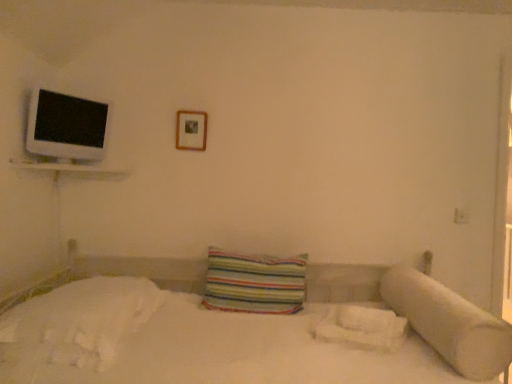
Question: Should I look upward or downward to see white soft pillow at right, arranged as the 1th pillow when viewed from the right?

Choices:
 (A) up
 (B) down

Answer: (B)

Question: Considering the relative positions of white glossy flat at upper left and white fluffy sheet at lower right, the second sheet from the left, in the image provided, is white glossy flat at upper left in front of white fluffy sheet at lower right, the second sheet from the left,?

Choices:
 (A) yes
 (B) no

Answer: (B)

Question: Does white glossy flat at upper left have a lesser height compared to white fluffy sheet at lower right, the second sheet from the left?

Choices:
 (A) no
 (B) yes

Answer: (A)

Question: Is white glossy flat at upper left behind white fluffy sheet at lower right, the second sheet from the left?

Choices:
 (A) yes
 (B) no

Answer: (A)

Question: From the image's perspective, would you say white glossy flat at upper left is shown under white fluffy sheet at lower right, arranged as the first sheet when viewed from the right?

Choices:
 (A) no
 (B) yes

Answer: (A)

Question: Is white glossy flat at upper left to the left of white fluffy sheet at lower right, the second sheet from the left, from the viewer's perspective?

Choices:
 (A) yes
 (B) no

Answer: (A)

Question: Is white glossy flat at upper left facing away from white fluffy sheet at lower right, arranged as the first sheet when viewed from the right?

Choices:
 (A) yes
 (B) no

Answer: (B)

Question: Could you tell me if white glossy flat at upper left is facing white soft bedsheet at lower left, arranged as the 2th sheet when viewed from the right?

Choices:
 (A) no
 (B) yes

Answer: (A)

Question: From a real-world perspective, is white glossy flat at upper left below white soft bedsheet at lower left, arranged as the 2th sheet when viewed from the right?

Choices:
 (A) yes
 (B) no

Answer: (B)

Question: Is white glossy flat at upper left oriented away from white soft bedsheet at lower left, the 1th sheet from the left?

Choices:
 (A) yes
 (B) no

Answer: (B)

Question: Considering the relative sizes of white glossy flat at upper left and white soft bedsheet at lower left, arranged as the 2th sheet when viewed from the right, in the image provided, is white glossy flat at upper left bigger than white soft bedsheet at lower left, arranged as the 2th sheet when viewed from the right,?

Choices:
 (A) yes
 (B) no

Answer: (B)

Question: Is the position of white glossy flat at upper left less distant than that of white soft bedsheet at lower left, arranged as the 2th sheet when viewed from the right?

Choices:
 (A) yes
 (B) no

Answer: (B)

Question: Does white glossy flat at upper left appear on the right side of white soft bedsheet at lower left, the 1th sheet from the left?

Choices:
 (A) no
 (B) yes

Answer: (A)

Question: Is white soft bedsheet at lower left, the 1th sheet from the left, facing away from striped fabric pillow at center, which is the 2th pillow in right-to-left order?

Choices:
 (A) no
 (B) yes

Answer: (A)